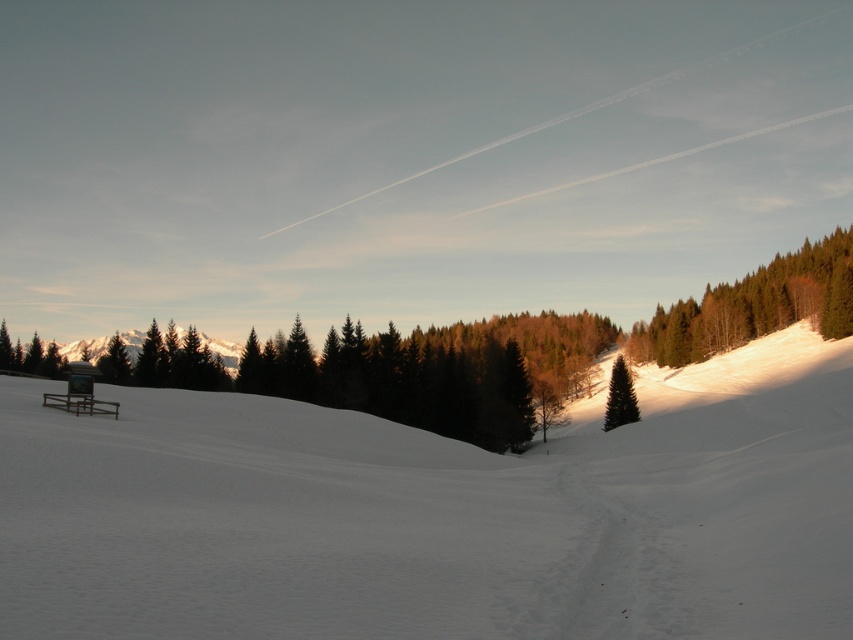
You are an observer standing at the edge of the snow in the winter scene. You see the white snow at center and the green matte tree at upper right. Which object is positioned more to the right side of the image?

The green matte tree at upper right is positioned more to the right side of the image compared to the white snow at center.

You are standing at the center of the snow field and want to walk towards the green matte tree at upper right. Which direction should you head?

Since the green matte tree at upper right is located at coordinates approximately 0.478 on the x axis and 0.885 on the y axis, you should head northeast to reach it.

You are an observer standing in the winter landscape. You notice the white snow at center and the green matte tree at right. Which object appears taller in the scene?

The white snow at center has a greater height compared to the green matte tree at right, so the white snow at center appears taller in the scene.